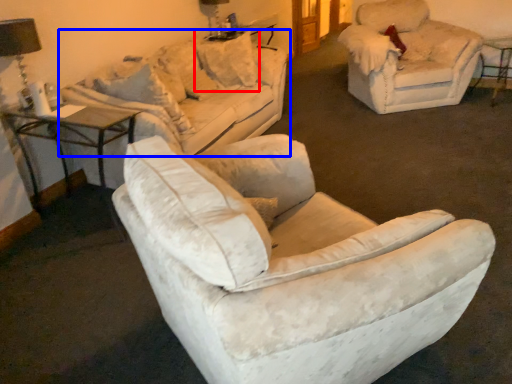
Question: Which of the following is the farthest to the observer, pillow (highlighted by a red box) or studio couch (highlighted by a blue box)?

Choices:
 (A) pillow
 (B) studio couch

Answer: (A)